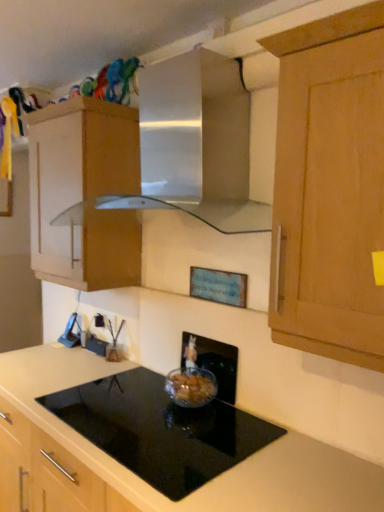
At what (x,y) coordinates should I click in order to perform the action: click on blank space situated above black glass cooktop at center (from a real-world perspective). Please return your answer as a coordinate pair (x, y). Image resolution: width=384 pixels, height=512 pixels. Looking at the image, I should click on (180, 415).